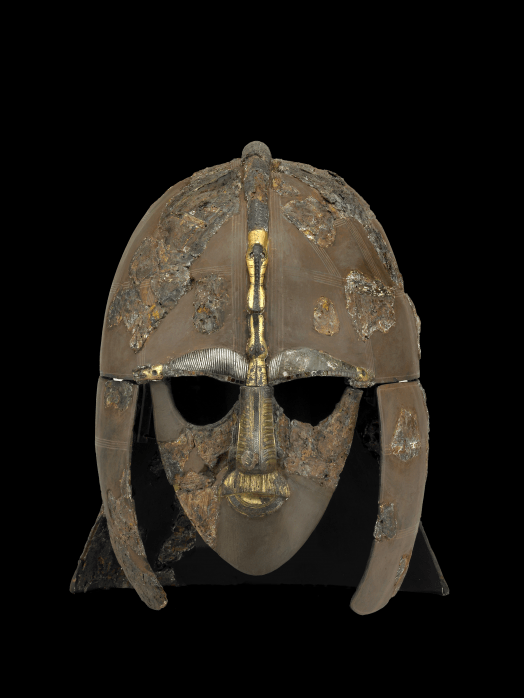
Find the location of a particular element. gold trim is located at coordinates (257, 276).